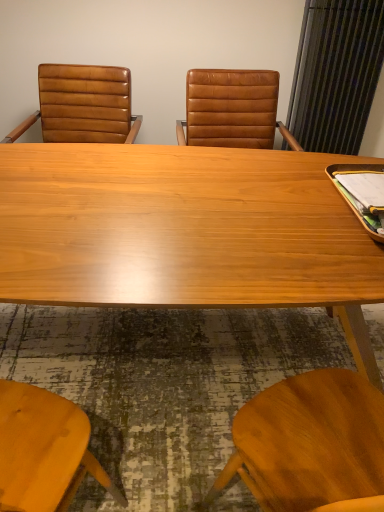
Question: Considering the relative positions of wooden desk at center and matte brown leather chair at left in the image provided, is wooden desk at center to the left or to the right of matte brown leather chair at left?

Choices:
 (A) right
 (B) left

Answer: (A)

Question: Considering the positions of wooden desk at center and matte brown leather chair at left in the image, is wooden desk at center wider or thinner than matte brown leather chair at left?

Choices:
 (A) thin
 (B) wide

Answer: (B)

Question: Does point (3, 273) appear closer or farther from the camera than point (114, 70)?

Choices:
 (A) closer
 (B) farther

Answer: (A)

Question: Relative to wooden desk at center, is matte brown leather chair at left in front or behind?

Choices:
 (A) behind
 (B) front

Answer: (A)

Question: Considering the positions of matte brown leather chair at left and wooden desk at center in the image, is matte brown leather chair at left wider or thinner than wooden desk at center?

Choices:
 (A) thin
 (B) wide

Answer: (A)

Question: Which is correct: matte brown leather chair at left is inside wooden desk at center, or outside of it?

Choices:
 (A) inside
 (B) outside

Answer: (B)

Question: From a real-world perspective, is matte brown leather chair at left physically located above or below wooden desk at center?

Choices:
 (A) below
 (B) above

Answer: (B)